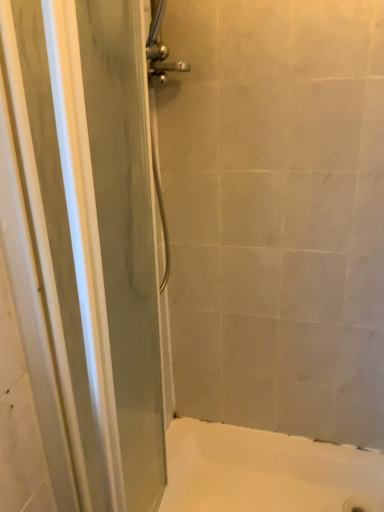
What do you see at coordinates (126, 234) in the screenshot? I see `transparent glass screen door at left` at bounding box center [126, 234].

The image size is (384, 512). Identify the location of transparent glass screen door at left. point(126,234).

In order to face transparent glass screen door at left, should I rotate leftwards or rightwards?

Rotate your view left by about 9.130°.

Measure the distance between point (167, 509) and camera.

The distance of point (167, 509) from camera is 1.45 meters.

Locate an element on the screen. This screenshot has width=384, height=512. white smooth bathtub at lower center is located at coordinates (266, 471).

What is the approximate height of white smooth bathtub at lower center?

The height of white smooth bathtub at lower center is 4.25 inches.

What is the approximate width of white smooth bathtub at lower center?

The width of white smooth bathtub at lower center is 17.15 inches.

The image size is (384, 512). What do you see at coordinates (266, 471) in the screenshot? I see `white smooth bathtub at lower center` at bounding box center [266, 471].

Identify the location of transparent glass screen door at left. (126, 234).

Is transparent glass screen door at left to the left of white smooth bathtub at lower center from the viewer's perspective?

Yes, transparent glass screen door at left is to the left of white smooth bathtub at lower center.

Based on the photo, is transparent glass screen door at left in front of or behind white smooth bathtub at lower center in the image?

Clearly, transparent glass screen door at left is in front of white smooth bathtub at lower center.

Between point (111, 159) and point (292, 455), which one is positioned behind?

Point (292, 455)

From the image's perspective, is transparent glass screen door at left located above or below white smooth bathtub at lower center?

From the image's perspective, transparent glass screen door at left appears above white smooth bathtub at lower center.

From the picture: From a real-world perspective, is transparent glass screen door at left physically above white smooth bathtub at lower center?

Yes, from a real-world perspective, transparent glass screen door at left is above white smooth bathtub at lower center.

Is transparent glass screen door at left wider than white smooth bathtub at lower center?

In fact, transparent glass screen door at left might be narrower than white smooth bathtub at lower center.

Looking at this image, considering the sizes of transparent glass screen door at left and white smooth bathtub at lower center in the image, is transparent glass screen door at left taller or shorter than white smooth bathtub at lower center?

Considering their sizes, transparent glass screen door at left has more height than white smooth bathtub at lower center.

Does transparent glass screen door at left have a smaller size compared to white smooth bathtub at lower center?

No, transparent glass screen door at left is not smaller than white smooth bathtub at lower center.

Is white smooth bathtub at lower center located within transparent glass screen door at left?

Definitely not — white smooth bathtub at lower center is not inside transparent glass screen door at left.

Would you consider transparent glass screen door at left to be distant from white smooth bathtub at lower center?

No, transparent glass screen door at left is not far from white smooth bathtub at lower center.

Could you tell me if transparent glass screen door at left is turned towards white smooth bathtub at lower center?

No, transparent glass screen door at left is not aimed at white smooth bathtub at lower center.

Measure the distance between transparent glass screen door at left and white smooth bathtub at lower center.

transparent glass screen door at left is 22.19 inches away from white smooth bathtub at lower center.

Identify the location of screen door that is on the left side of white smooth bathtub at lower center. Image resolution: width=384 pixels, height=512 pixels. (126, 234).

In the image, is white smooth bathtub at lower center on the left side or the right side of transparent glass screen door at left?

From the image, it's evident that white smooth bathtub at lower center is to the right of transparent glass screen door at left.

Considering the positions of objects white smooth bathtub at lower center and transparent glass screen door at left in the image provided, who is in front, white smooth bathtub at lower center or transparent glass screen door at left?

Positioned in front is transparent glass screen door at left.

Is point (298, 480) more distant than point (134, 342)?

No.

From the image's perspective, is white smooth bathtub at lower center above transparent glass screen door at left?

No.

From a real-world perspective, between white smooth bathtub at lower center and transparent glass screen door at left, who is vertically lower?

white smooth bathtub at lower center.

In terms of width, does white smooth bathtub at lower center look wider or thinner when compared to transparent glass screen door at left?

Considering their sizes, white smooth bathtub at lower center looks broader than transparent glass screen door at left.

Is white smooth bathtub at lower center taller than transparent glass screen door at left?

In fact, white smooth bathtub at lower center may be shorter than transparent glass screen door at left.

In the scene shown: Considering the sizes of objects white smooth bathtub at lower center and transparent glass screen door at left in the image provided, who is smaller, white smooth bathtub at lower center or transparent glass screen door at left?

With smaller size is white smooth bathtub at lower center.

Would you say white smooth bathtub at lower center is outside transparent glass screen door at left?

Yes.

Is white smooth bathtub at lower center not near transparent glass screen door at left?

They are positioned close to each other.

Is white smooth bathtub at lower center positioned with its back to transparent glass screen door at left?

No, white smooth bathtub at lower center is not facing away from transparent glass screen door at left.

Can you tell me how much white smooth bathtub at lower center and transparent glass screen door at left differ in facing direction?

There is a 90.5-degree angle between the facing directions of white smooth bathtub at lower center and transparent glass screen door at left.

Image resolution: width=384 pixels, height=512 pixels. Find the location of `bath located underneath the transparent glass screen door at left (from a real-world perspective)`. bath located underneath the transparent glass screen door at left (from a real-world perspective) is located at coordinates (266, 471).

You are a GUI agent. You are given a task and a screenshot of the screen. Output one action in this format:
    pyautogui.click(x=<x>, y=<y>)
    Task: Click on the bath lying behind the transparent glass screen door at left
    This screenshot has height=512, width=384.
    Given the screenshot: What is the action you would take?
    pyautogui.click(x=266, y=471)

Locate an element on the screen. The image size is (384, 512). bath on the right of transparent glass screen door at left is located at coordinates (266, 471).